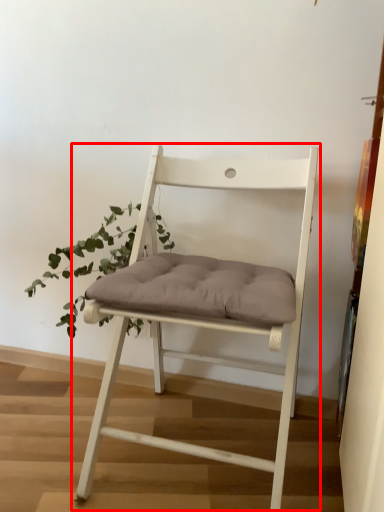
Question: Considering the relative positions of chair (annotated by the red box) and houseplant in the image provided, where is chair (annotated by the red box) located with respect to the staircase?

Choices:
 (A) left
 (B) right

Answer: (B)